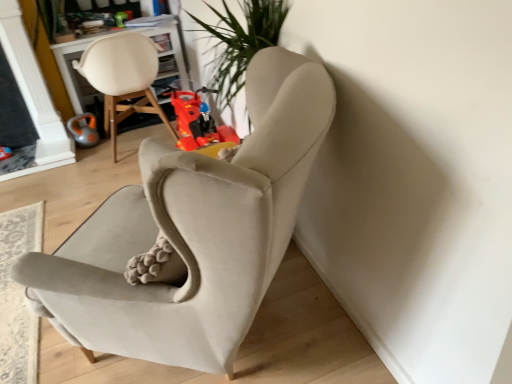
Question: From a real-world perspective, is rubberized plastic toy motorcycle at center, the second toy in the left-to-right sequence, positioned over orange rubber toy at left, which is the second toy from right to left, based on gravity?

Choices:
 (A) yes
 (B) no

Answer: (A)

Question: From the image's perspective, is rubberized plastic toy motorcycle at center, the second toy in the left-to-right sequence, under orange rubber toy at left, which is the second toy from right to left?

Choices:
 (A) no
 (B) yes

Answer: (B)

Question: Is rubberized plastic toy motorcycle at center, the second toy in the left-to-right sequence, located outside orange rubber toy at left, which is the second toy from right to left?

Choices:
 (A) no
 (B) yes

Answer: (B)

Question: Is rubberized plastic toy motorcycle at center, the second toy in the left-to-right sequence, positioned with its back to orange rubber toy at left, marked as the first toy in a left-to-right arrangement?

Choices:
 (A) yes
 (B) no

Answer: (B)

Question: From a real-world perspective, is rubberized plastic toy motorcycle at center, which is the first toy in right-to-left order, under orange rubber toy at left, marked as the first toy in a left-to-right arrangement?

Choices:
 (A) no
 (B) yes

Answer: (A)

Question: Is suede beige armchair at center, positioned as the second chair in left-to-right order, bigger or smaller than matte white chair at upper left, which appears as the second chair when viewed from the right?

Choices:
 (A) big
 (B) small

Answer: (B)

Question: From the image's perspective, is suede beige armchair at center, positioned as the second chair in left-to-right order, above or below matte white chair at upper left, marked as the 1th chair in a left-to-right arrangement?

Choices:
 (A) above
 (B) below

Answer: (B)

Question: Do you think suede beige armchair at center, positioned as the second chair in left-to-right order, is within matte white chair at upper left, marked as the 1th chair in a left-to-right arrangement, or outside of it?

Choices:
 (A) outside
 (B) inside

Answer: (A)

Question: Is point (118, 228) closer or farther from the camera than point (132, 74)?

Choices:
 (A) closer
 (B) farther

Answer: (A)

Question: Relative to matte white chair at upper left, which appears as the second chair when viewed from the right, is rubberized plastic toy motorcycle at center, which is the first toy in right-to-left order, in front or behind?

Choices:
 (A) front
 (B) behind

Answer: (A)

Question: Looking at the image, does rubberized plastic toy motorcycle at center, the second toy in the left-to-right sequence, seem bigger or smaller compared to matte white chair at upper left, marked as the 1th chair in a left-to-right arrangement?

Choices:
 (A) big
 (B) small

Answer: (B)

Question: Is rubberized plastic toy motorcycle at center, which is the first toy in right-to-left order, inside or outside of matte white chair at upper left, which appears as the second chair when viewed from the right?

Choices:
 (A) inside
 (B) outside

Answer: (B)

Question: Visually, is rubberized plastic toy motorcycle at center, the second toy in the left-to-right sequence, positioned to the left or to the right of matte white chair at upper left, marked as the 1th chair in a left-to-right arrangement?

Choices:
 (A) right
 (B) left

Answer: (A)

Question: From the image's perspective, is matte white chair at upper left, which appears as the second chair when viewed from the right, above or below orange rubber toy at left, marked as the first toy in a left-to-right arrangement?

Choices:
 (A) below
 (B) above

Answer: (B)

Question: Is point (115, 115) closer or farther from the camera than point (68, 127)?

Choices:
 (A) closer
 (B) farther

Answer: (B)